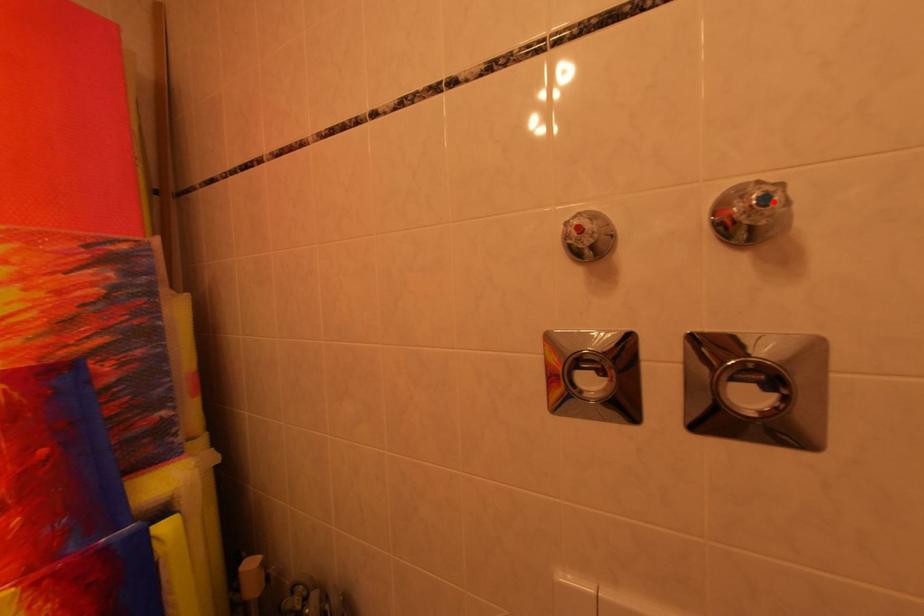
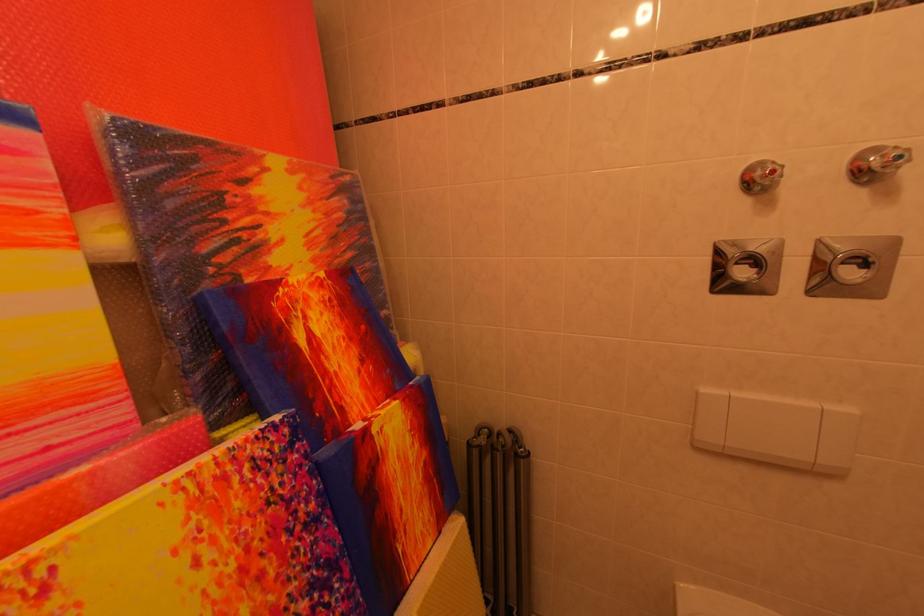
In the second image, find the point that corresponds to the highlighted location in the first image.

(907, 161)